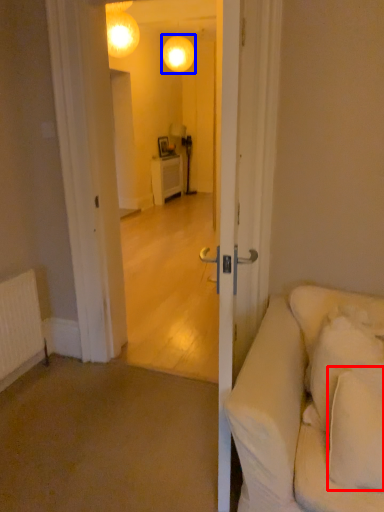
Question: Which object appears farthest to the camera in this image, pillow (highlighted by a red box) or lamp (highlighted by a blue box)?

Choices:
 (A) pillow
 (B) lamp

Answer: (B)